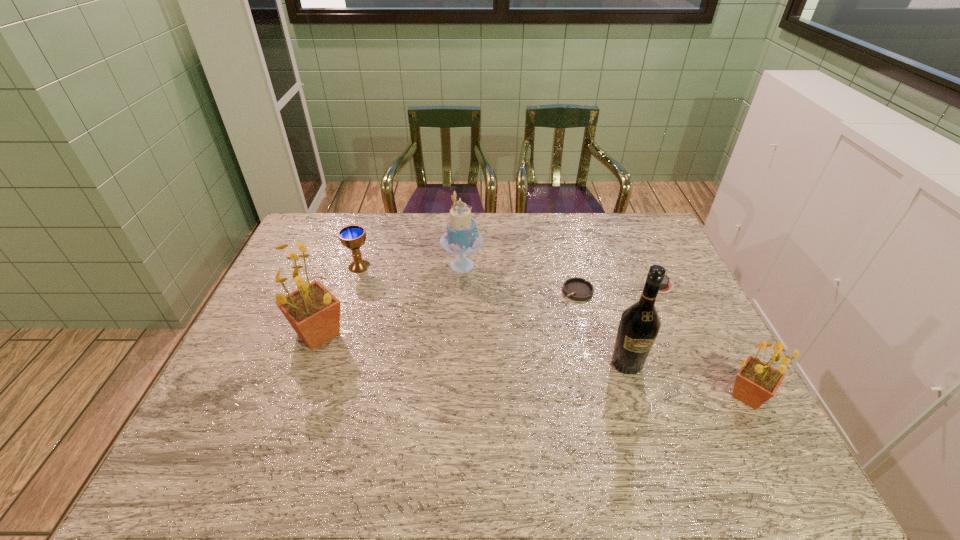
Identify the location of vacant space that is in between the taller sunflower and the ashtray. The image size is (960, 540). tap(448, 313).

Where is `blank region between the chocolate cake and the ashtray`? The width and height of the screenshot is (960, 540). blank region between the chocolate cake and the ashtray is located at coordinates (618, 287).

The height and width of the screenshot is (540, 960). What are the coordinates of `free spot between the chocolate cake and the third object from left to right` in the screenshot? It's located at (561, 274).

At what (x,y) coordinates should I click in order to perform the action: click on vacant area that lies between the ashtray and the shorter sunflower. Please return your answer as a coordinate pair (x, y). The height and width of the screenshot is (540, 960). Looking at the image, I should click on (662, 343).

Where is `vacant area that lies between the chocolate cake and the chalice`? vacant area that lies between the chocolate cake and the chalice is located at coordinates tap(509, 275).

This screenshot has height=540, width=960. I want to click on free spot between the ashtray and the third object from left to right, so click(x=520, y=278).

Locate which object is the second closest to the farther sunflower. Please provide its 2D coordinates. Your answer should be formatted as a tuple, i.e. [(x, y)], where the tuple contains the x and y coordinates of a point satisfying the conditions above.

[(462, 237)]

Select which object appears as the fourth closest to the wine bottle. Please provide its 2D coordinates. Your answer should be formatted as a tuple, i.e. [(x, y)], where the tuple contains the x and y coordinates of a point satisfying the conditions above.

[(462, 237)]

Where is `vacant position in the image that satisfies the following two spatial constraints: 1. with a ladder on the side of the cake; 2. on the right side of the ashtray`? This screenshot has height=540, width=960. vacant position in the image that satisfies the following two spatial constraints: 1. with a ladder on the side of the cake; 2. on the right side of the ashtray is located at coordinates (461, 291).

At what (x,y) coordinates should I click in order to perform the action: click on free space that satisfies the following two spatial constraints: 1. with a ladder on the side of the chocolate cake; 2. on the left side of the fifth object from right to left. Please return your answer as a coordinate pair (x, y). Looking at the image, I should click on (461, 284).